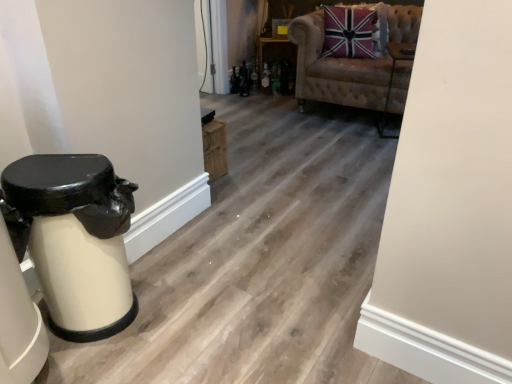
Locate an element on the screen. free space to the right of white glossy trash can at left is located at coordinates (206, 316).